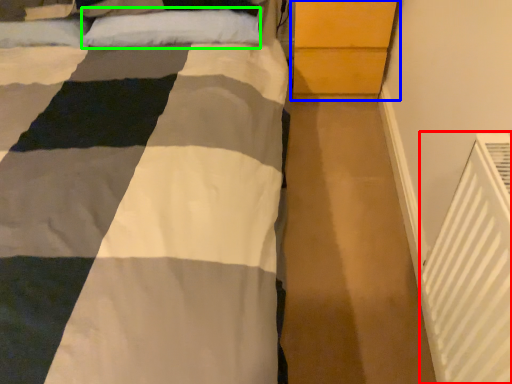
Question: Which object is the closest to the air conditioning (highlighted by a red box)? Choose among these: dresser (highlighted by a blue box) or pillow (highlighted by a green box).

Choices:
 (A) dresser
 (B) pillow

Answer: (A)